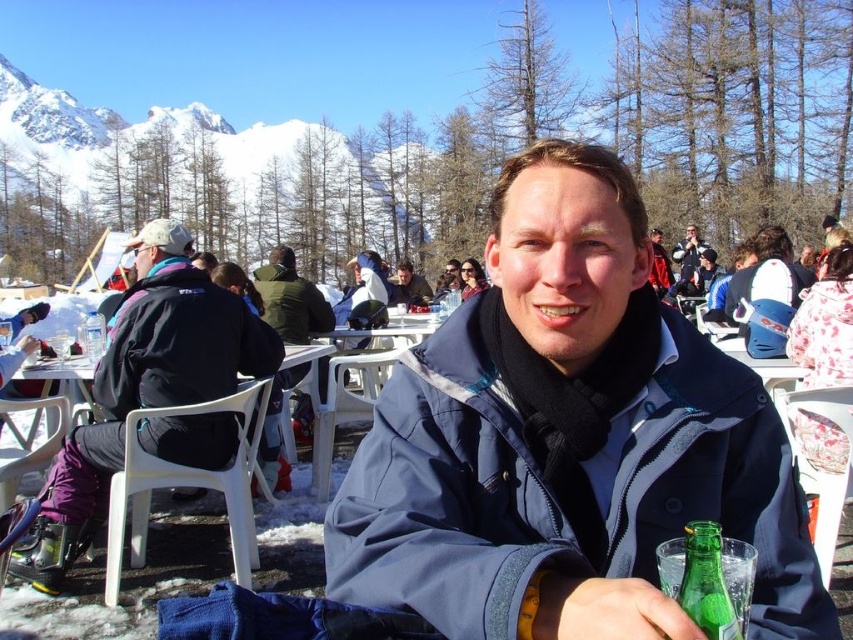
Between white plastic table at lower left and clear plastic bottle at center, which one has more height?

white plastic table at lower left is taller.

Between point (318, 358) and point (86, 332), which one is positioned in front?

Point (86, 332)

Locate an element on the screen. white plastic table at lower left is located at coordinates (306, 364).

Find the location of a particular element. The width and height of the screenshot is (853, 640). white plastic table at lower left is located at coordinates (306, 364).

Does green glass bottle at lower right appear over blue fleece jacket at center?

Actually, green glass bottle at lower right is below blue fleece jacket at center.

In the scene shown: Can you confirm if green glass bottle at lower right is positioned below blue fleece jacket at center?

Indeed, green glass bottle at lower right is positioned under blue fleece jacket at center.

Does point (720, 595) come farther from viewer compared to point (693, 264)?

That is False.

This screenshot has width=853, height=640. Find the location of `green glass bottle at lower right`. green glass bottle at lower right is located at coordinates (706, 582).

Does dark green jacket at center have a smaller size compared to blue fleece jacket at center?

No, dark green jacket at center is not smaller than blue fleece jacket at center.

Is dark green jacket at center below blue fleece jacket at center?

Indeed, dark green jacket at center is positioned under blue fleece jacket at center.

I want to click on dark green jacket at center, so click(291, 300).

Locate an element on the screen. This screenshot has height=640, width=853. dark green jacket at center is located at coordinates (291, 300).